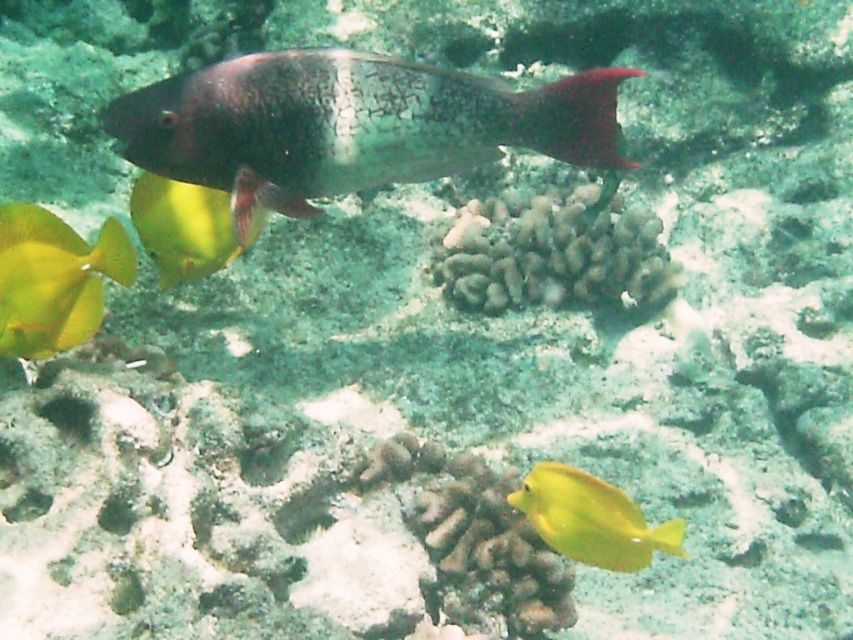
Question: Which object is positioned farthest from the speckled silver fish at center?

Choices:
 (A) smooth yellow fish at left
 (B) yellow matte fish at lower right
 (C) bumpy coral at center

Answer: (C)

Question: Which point appears farthest from the camera in this image?

Choices:
 (A) (515, 138)
 (B) (550, 269)
 (C) (256, 218)

Answer: (B)

Question: In this image, where is speckled silver fish at center located relative to yellow matte fish at lower right?

Choices:
 (A) right
 (B) left

Answer: (B)

Question: Among these points, which one is farthest from the camera?

Choices:
 (A) tap(93, 292)
 (B) tap(175, 182)
 (C) tap(607, 90)

Answer: (B)

Question: Is bumpy coral at center bigger than yellow matte fish at lower right?

Choices:
 (A) yes
 (B) no

Answer: (A)

Question: Is bumpy coral at center further to the viewer compared to smooth yellow fish at left?

Choices:
 (A) yes
 (B) no

Answer: (A)